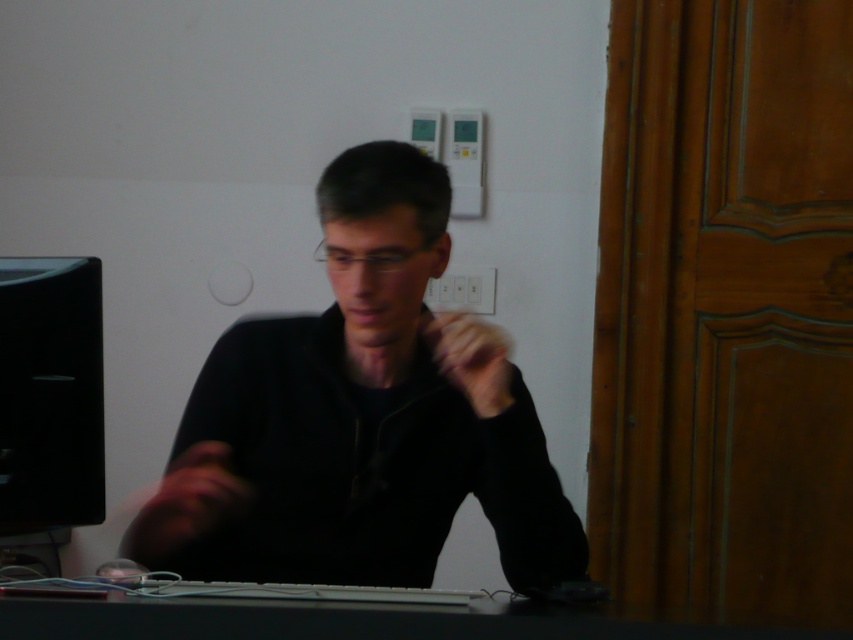
You are a photographer setting up a shot of the scene. You notice the black matte shirt at center and the black glossy monitor at left. Which object should you focus on first to ensure both are in sharp focus, considering their positions?

You should focus on the black glossy monitor at left first because it is further away from the viewer than the black matte shirt at center. By focusing on the farther object first, you can adjust the depth of field to include both in sharp focus.

You are organizing a photo shoot and need to ensure that the black matte shirt at center and the black plastic keyboard at lower center are clearly visible in the frame. Given their sizes, which object might require more careful lighting adjustments to avoid blending into the dark desk?

The black matte shirt at center is thinner than the black plastic keyboard at lower center, so the thinner black matte shirt at center might require more careful lighting adjustments to ensure it stands out against the dark desk.

You are standing in the room and want to place a small object on the desk. There are two points marked on the desk surface at coordinates point [74,336] and point [67,593]. Which point is closer to the computer monitor located on the left side of the image?

Point [74,336] is behind point [67,593], so the point closer to the computer monitor on the left would be point [74,336].